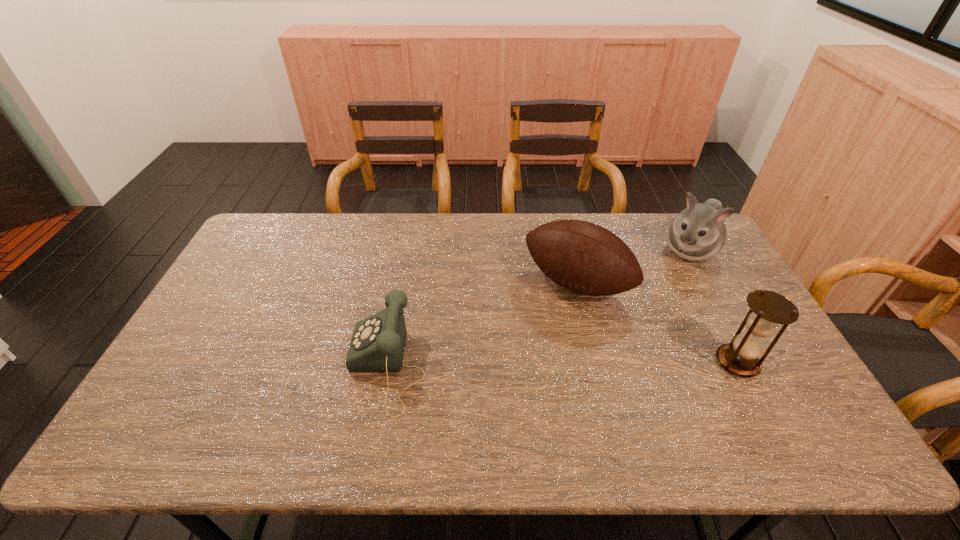
In the image, there is a desktop. Where is `free space at the far edge`? The width and height of the screenshot is (960, 540). free space at the far edge is located at coordinates (540, 220).

The width and height of the screenshot is (960, 540). What are the coordinates of `vacant position at the near edge of the desktop` in the screenshot? It's located at (371, 384).

The width and height of the screenshot is (960, 540). In the image, there is a desktop. In order to click on vacant space at the left edge in this screenshot , I will do `click(213, 326)`.

What are the coordinates of `free space at the far left corner of the desktop` in the screenshot? It's located at (266, 214).

Where is `vacant region at the far right corner of the desktop`? This screenshot has height=540, width=960. vacant region at the far right corner of the desktop is located at coordinates click(x=671, y=222).

You are a GUI agent. You are given a task and a screenshot of the screen. Output one action in this format:
    pyautogui.click(x=<x>, y=<y>)
    Task: Click on the vacant space that's between the hourglass and the hamster
    The image size is (960, 540).
    Given the screenshot: What is the action you would take?
    pyautogui.click(x=713, y=306)

The width and height of the screenshot is (960, 540). In order to click on vacant region between the second object from left to right and the telephone in this screenshot , I will do `click(482, 325)`.

This screenshot has height=540, width=960. Find the location of `vacant region between the football and the shortest object`. vacant region between the football and the shortest object is located at coordinates (482, 325).

Where is `free area in between the hourglass and the second object from left to right`? The height and width of the screenshot is (540, 960). free area in between the hourglass and the second object from left to right is located at coordinates (657, 322).

You are a GUI agent. You are given a task and a screenshot of the screen. Output one action in this format:
    pyautogui.click(x=<x>, y=<y>)
    Task: Click on the free area in between the hourglass and the football
    The image size is (960, 540).
    Given the screenshot: What is the action you would take?
    pyautogui.click(x=657, y=322)